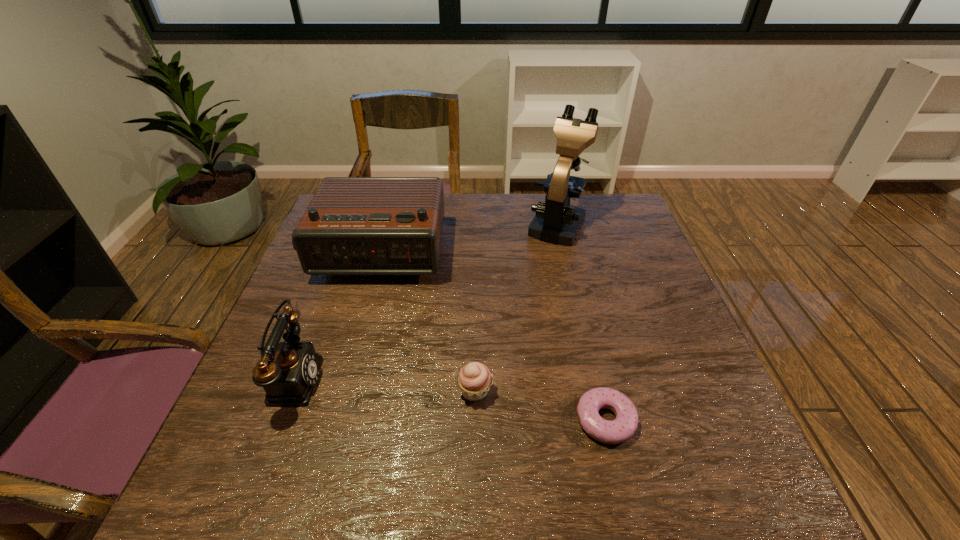
Locate an element on the screen. This screenshot has width=960, height=540. vacant space located 0.210m on the left of the doughnut is located at coordinates (468, 420).

The height and width of the screenshot is (540, 960). In order to click on microscope at the far edge in this screenshot , I will do `click(557, 222)`.

Find the location of a particular element. This screenshot has width=960, height=540. radio receiver at the far edge is located at coordinates (353, 225).

Locate an element on the screen. This screenshot has height=540, width=960. radio receiver that is at the left edge is located at coordinates (353, 225).

At what (x,y) coordinates should I click in order to perform the action: click on telephone present at the left edge. Please return your answer as a coordinate pair (x, y). Looking at the image, I should click on point(288,379).

At what (x,y) coordinates should I click in order to perform the action: click on object positioned at the right edge. Please return your answer as a coordinate pair (x, y). Looking at the image, I should click on (557, 222).

Identify the location of object that is at the far left corner. (353, 225).

This screenshot has width=960, height=540. In order to click on object present at the far right corner in this screenshot , I will do `click(557, 222)`.

Find the location of a particular element. Image resolution: width=960 pixels, height=540 pixels. vacant space at the far edge of the desktop is located at coordinates (511, 211).

Identify the location of free point at the near edge. (624, 465).